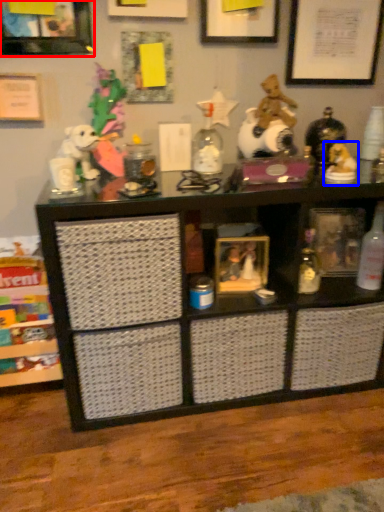
Question: Among these objects, which one is nearest to the camera, picture frame (highlighted by a red box) or toy (highlighted by a blue box)?

Choices:
 (A) picture frame
 (B) toy

Answer: (A)